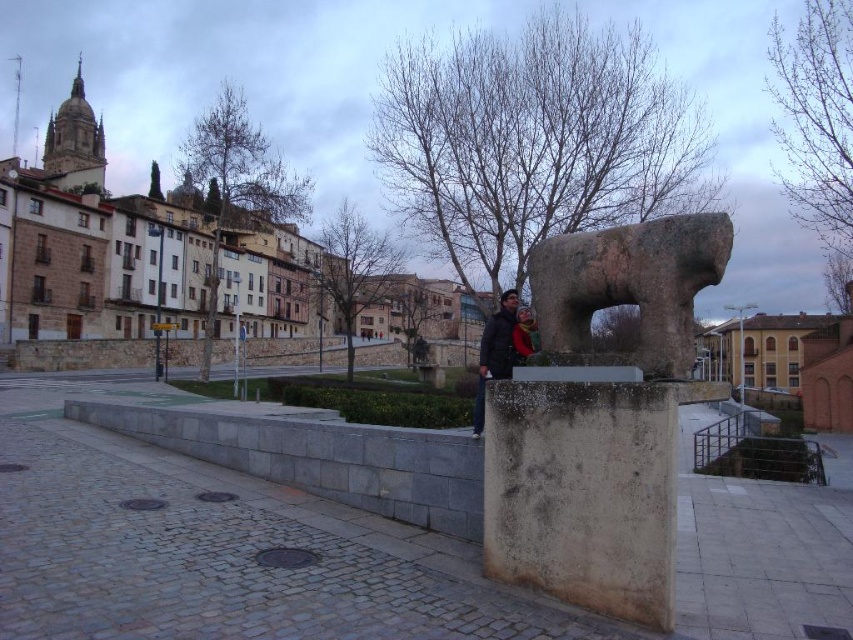
Question: Among these points, which one is farthest from the camera?

Choices:
 (A) (532, 342)
 (B) (84, 577)
 (C) (643, 500)
 (D) (583, 305)

Answer: (A)

Question: Does dark gray jacket at center appear on the left side of yellow wool scarf at center?

Choices:
 (A) yes
 (B) no

Answer: (B)

Question: Which of the following is the farthest from the observer?

Choices:
 (A) yellow wool scarf at center
 (B) dark gray jacket at center
 (C) gray stone sculpture at center

Answer: (A)

Question: Can you confirm if smooth concrete block at center is thinner than gray stone sculpture at center?

Choices:
 (A) no
 (B) yes

Answer: (A)

Question: In this image, where is rustic stone bull at center located relative to dark gray jacket at center?

Choices:
 (A) right
 (B) left

Answer: (A)

Question: Which of the following is the closest to the observer?

Choices:
 (A) click(498, 332)
 (B) click(225, 518)

Answer: (B)